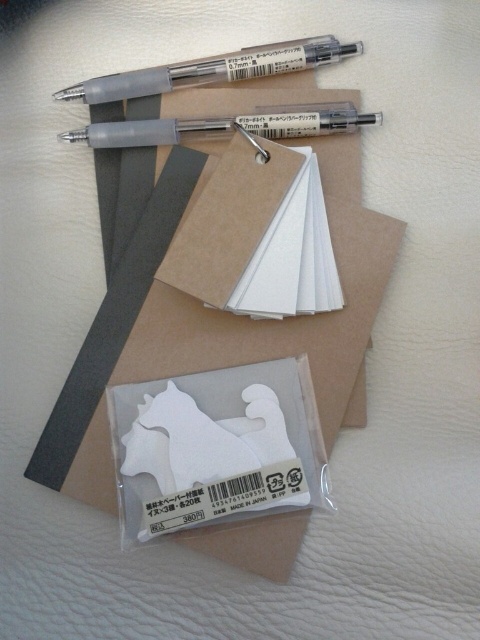
Question: Observing the image, what is the correct spatial positioning of transparent plastic pen at upper center in reference to matte gray pen at upper center?

Choices:
 (A) below
 (B) above

Answer: (B)

Question: Does transparent plastic pen at upper center have a greater width compared to matte gray pen at upper center?

Choices:
 (A) yes
 (B) no

Answer: (B)

Question: Is transparent plastic pen at upper center to the right of matte gray pen at upper center from the viewer's perspective?

Choices:
 (A) no
 (B) yes

Answer: (A)

Question: Which of the following is the closest to the observer?

Choices:
 (A) (256, 60)
 (B) (287, 116)

Answer: (B)

Question: Which point is closer to the camera?

Choices:
 (A) transparent plastic pen at upper center
 (B) matte gray pen at upper center

Answer: (B)